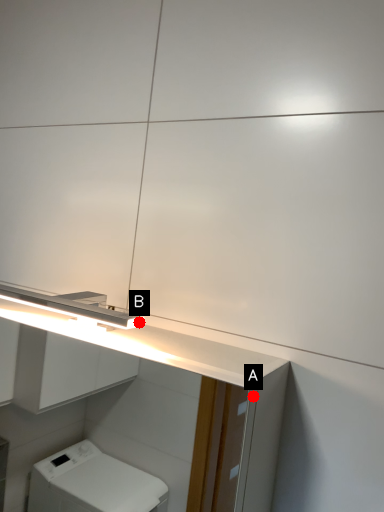
Question: Two points are circled on the image, labeled by A and B beside each circle. Which point appears closest to the camera in this image?

Choices:
 (A) A is closer
 (B) B is closer

Answer: (A)